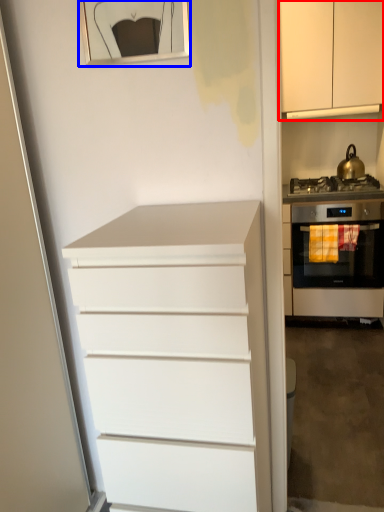
Question: Among these objects, which one is farthest to the camera, cabinetry (highlighted by a red box) or picture frame (highlighted by a blue box)?

Choices:
 (A) cabinetry
 (B) picture frame

Answer: (A)